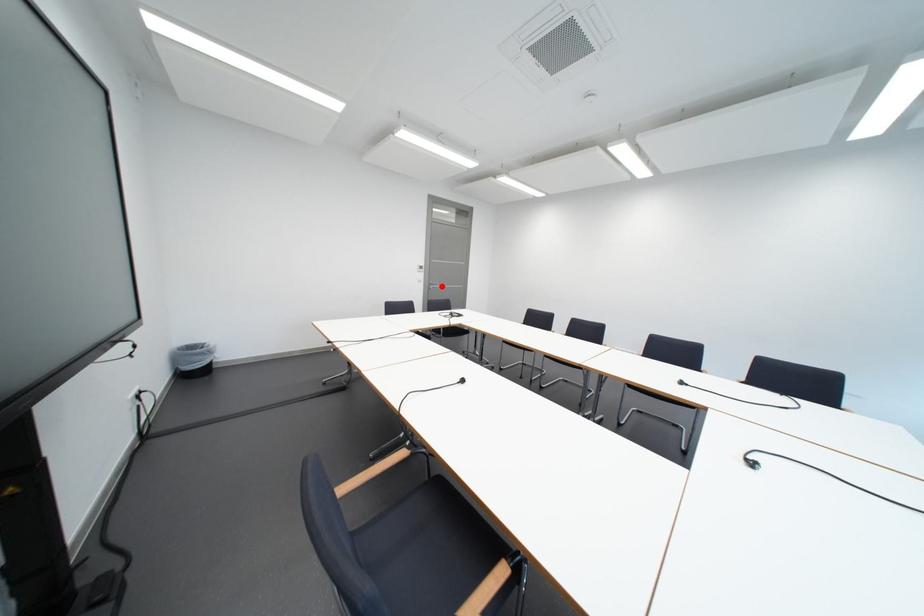
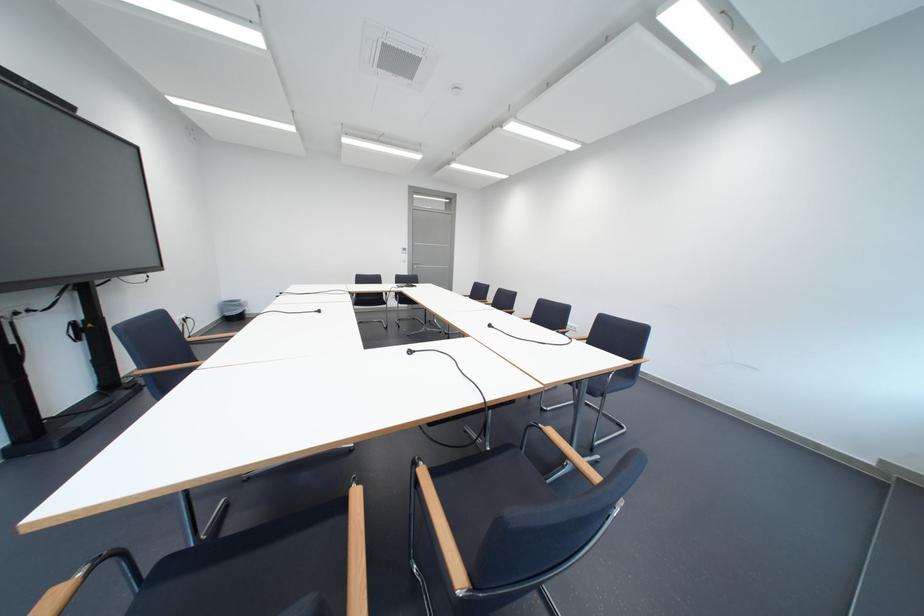
Where in the second image is the point corresponding to the highlighted location from the first image?

(426, 265)